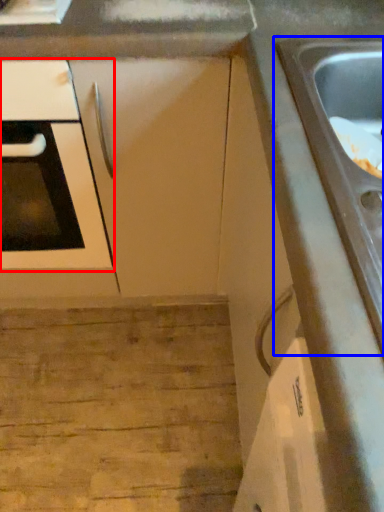
Question: Which object appears farthest to the camera in this image, oven (highlighted by a red box) or sink (highlighted by a blue box)?

Choices:
 (A) oven
 (B) sink

Answer: (A)